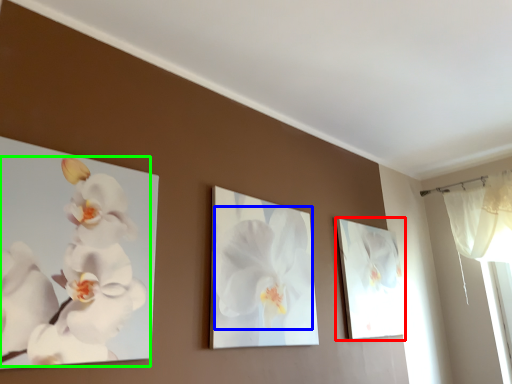
Question: Estimate the real-world distances between objects in this image. Which object is farther from picture frame (highlighted by a red box), flower (highlighted by a blue box) or flower (highlighted by a green box)?

Choices:
 (A) flower
 (B) flower

Answer: (B)